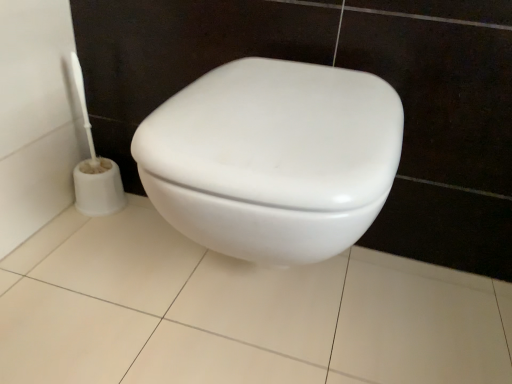
The image size is (512, 384). What do you see at coordinates (273, 158) in the screenshot? I see `white glossy toilet at center` at bounding box center [273, 158].

This screenshot has width=512, height=384. In order to click on white glossy toilet at center in this screenshot , I will do `click(273, 158)`.

I want to click on white glossy toilet at center, so click(x=273, y=158).